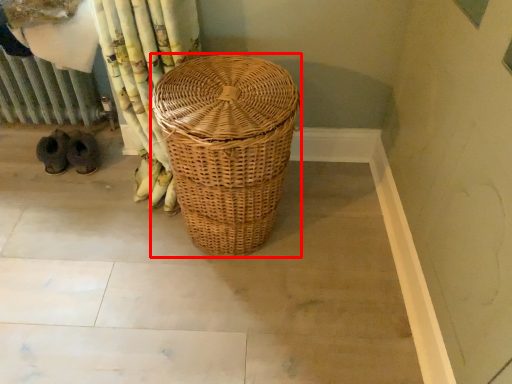
Question: In this image, where is picnic basket (annotated by the red box) located relative to radiator?

Choices:
 (A) right
 (B) left

Answer: (A)